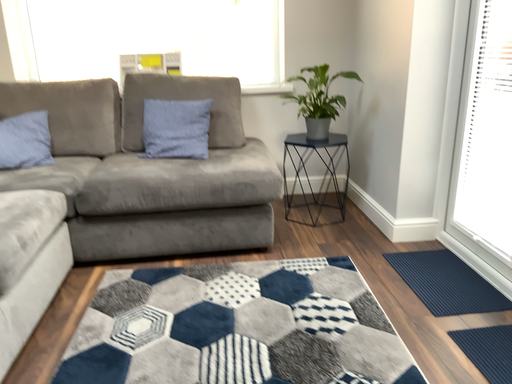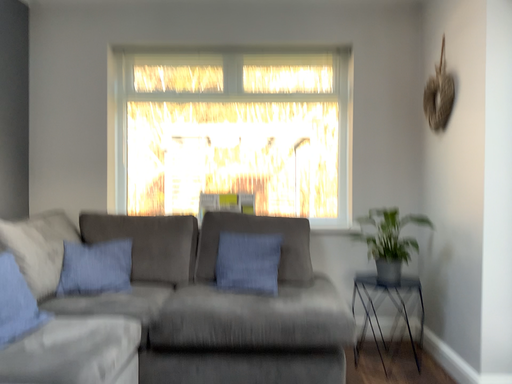
Question: How did the camera likely rotate when shooting the video?

Choices:
 (A) rotated right
 (B) rotated left

Answer: (B)